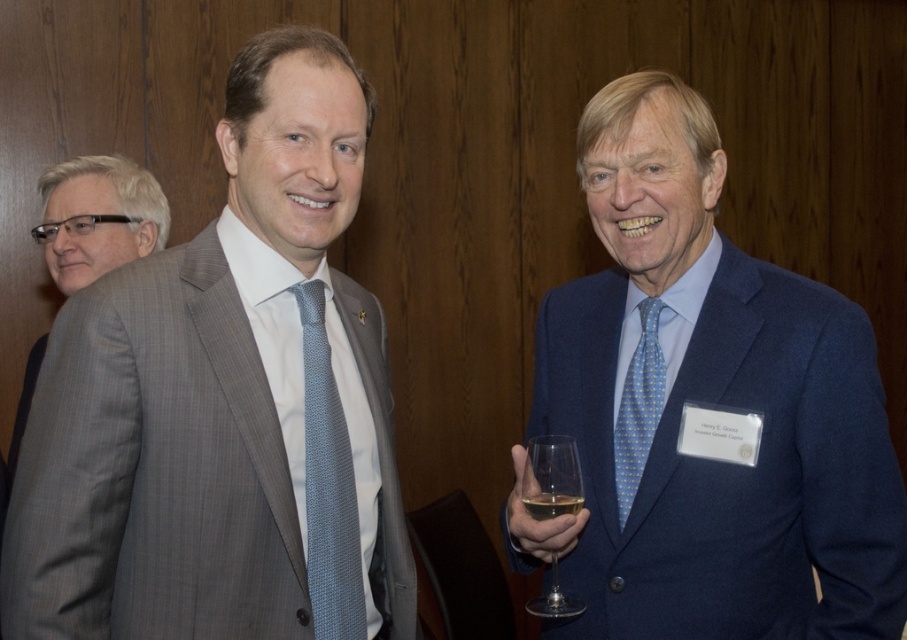
The height and width of the screenshot is (640, 907). What are the coordinates of `gray pinstripe suit at center` in the screenshot? It's located at (223, 404).

What do you see at coordinates (223, 404) in the screenshot?
I see `gray pinstripe suit at center` at bounding box center [223, 404].

Locate an element on the screen. The width and height of the screenshot is (907, 640). gray pinstripe suit at center is located at coordinates (223, 404).

Which is in front, point (266, 448) or point (348, 604)?

Positioned in front is point (266, 448).

Where is `gray pinstripe suit at center`? This screenshot has width=907, height=640. gray pinstripe suit at center is located at coordinates (223, 404).

Which is behind, point (122, 516) or point (338, 614)?

The point (338, 614) is behind.

Locate an element on the screen. gray pinstripe suit at center is located at coordinates (223, 404).

Who is higher up, gray pinstripe suit at center or blue dotted tie at right?

gray pinstripe suit at center

Does gray pinstripe suit at center have a greater width compared to blue dotted tie at right?

No.

Where is `gray pinstripe suit at center`? This screenshot has height=640, width=907. gray pinstripe suit at center is located at coordinates (223, 404).